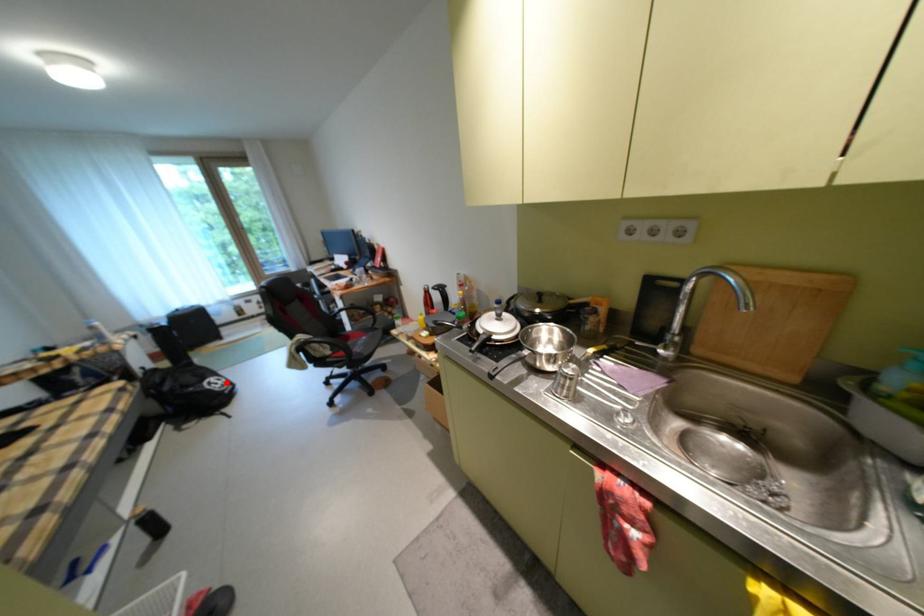
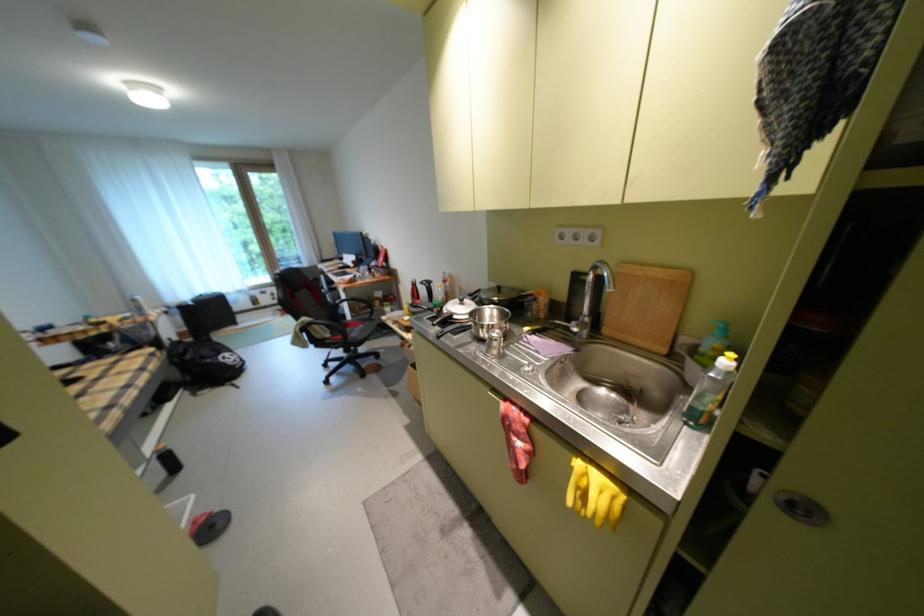
The point at the highlighted location is marked in the first image. Where is the corresponding point in the second image?

(239, 358)